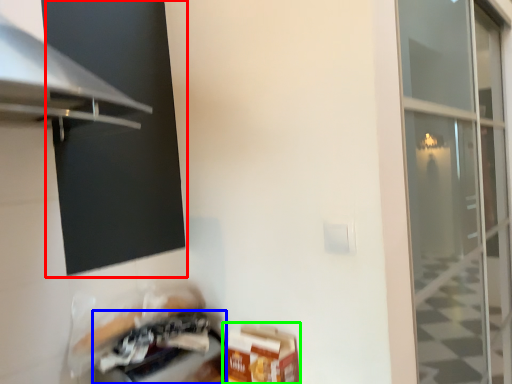
Question: Based on their relative distances, which object is farther from window screen (highlighted by a red box)? Choose from appliance (highlighted by a blue box) and cardboard box (highlighted by a green box).

Choices:
 (A) appliance
 (B) cardboard box

Answer: (B)